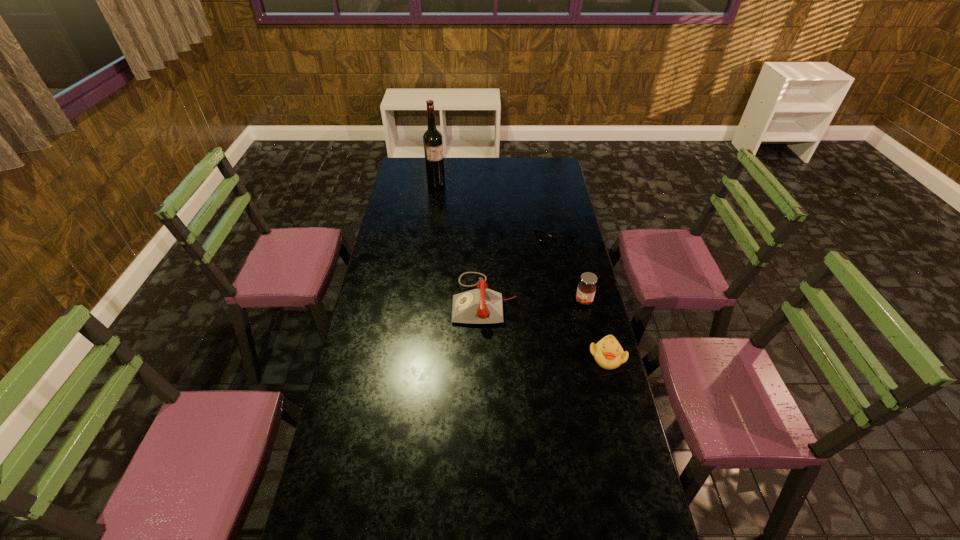
What are the coordinates of `free point at the near right corner` in the screenshot? It's located at (611, 504).

This screenshot has height=540, width=960. What are the coordinates of `vacant space that's between the spectacles and the second object from left to right` in the screenshot? It's located at (519, 269).

Where is `free space between the fourth object from right to left and the wine bottle`? The image size is (960, 540). free space between the fourth object from right to left and the wine bottle is located at coordinates (461, 241).

Image resolution: width=960 pixels, height=540 pixels. In order to click on unoccupied position between the duckling and the telephone in this screenshot , I will do `click(546, 328)`.

The width and height of the screenshot is (960, 540). I want to click on free spot between the telephone and the second farthest object, so click(x=519, y=269).

Locate an element on the screen. The width and height of the screenshot is (960, 540). free space between the wine bottle and the nearest object is located at coordinates 521,270.

Locate an element on the screen. vacant space that is in between the second farthest object and the telephone is located at coordinates pos(519,269).

What are the coordinates of `empty location between the duckling and the telephone` in the screenshot? It's located at (546, 328).

Where is `vacant point located between the farthest object and the second farthest object`? The width and height of the screenshot is (960, 540). vacant point located between the farthest object and the second farthest object is located at coordinates (495, 211).

Locate an element on the screen. This screenshot has width=960, height=540. free space that is in between the jam and the spectacles is located at coordinates (569, 269).